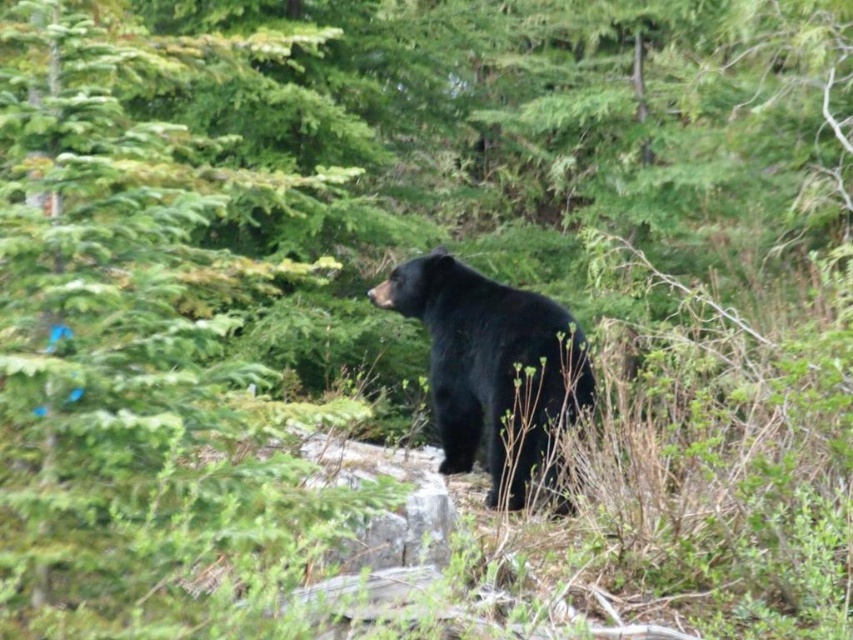
Question: In this image, where is green leafy tree at center located relative to black furry bear at center?

Choices:
 (A) left
 (B) right

Answer: (A)

Question: Is green leafy tree at center in front of black furry bear at center?

Choices:
 (A) no
 (B) yes

Answer: (B)

Question: Which of the following is the farthest from the observer?

Choices:
 (A) black furry bear at center
 (B) green leafy tree at center

Answer: (A)

Question: Is green leafy tree at center positioned before black furry bear at center?

Choices:
 (A) no
 (B) yes

Answer: (B)

Question: Which of the following is the farthest from the observer?

Choices:
 (A) (122, 60)
 (B) (547, 355)

Answer: (B)